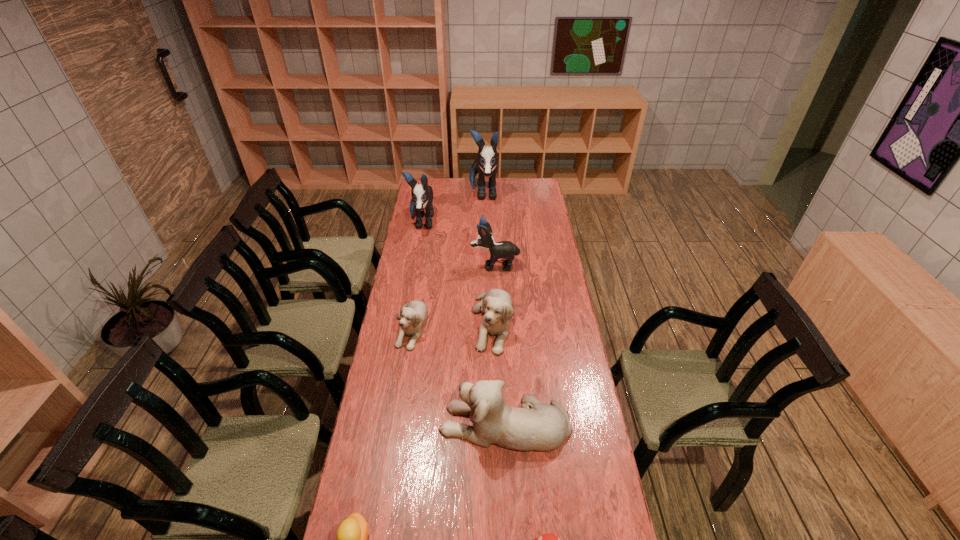
Locate which black puppy is the closest to the second tallest object. Please provide its 2D coordinates. Your answer should be formatted as a tuple, i.e. [(x, y)], where the tuple contains the x and y coordinates of a point satisfying the conditions above.

[(486, 164)]

Find the location of a particular element. black puppy that is the third closest to the duckling is located at coordinates (486, 164).

Image resolution: width=960 pixels, height=540 pixels. Find the location of `white puppy that stands as the second closest to the smallest white puppy`. white puppy that stands as the second closest to the smallest white puppy is located at coordinates (543, 427).

Identify which white puppy is the second closest to the apple. Please provide its 2D coordinates. Your answer should be formatted as a tuple, i.e. [(x, y)], where the tuple contains the x and y coordinates of a point satisfying the conditions above.

[(496, 304)]

The height and width of the screenshot is (540, 960). Identify the location of free spot that satisfies the following two spatial constraints: 1. on the front-facing side of the smallest black puppy; 2. on the front-facing side of the fifth tallest puppy. (497, 323).